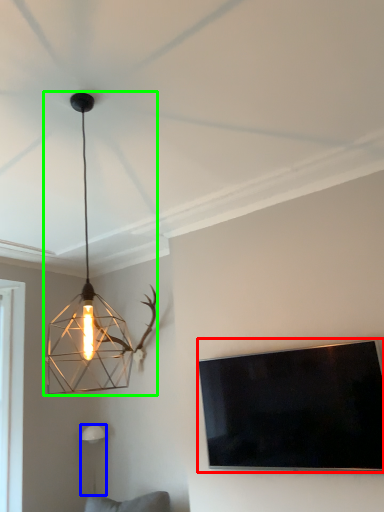
Question: Considering the real-world distances, which object is farthest from television (highlighted by a red box)? lamp (highlighted by a blue box) or lamp (highlighted by a green box)?

Choices:
 (A) lamp
 (B) lamp

Answer: (A)